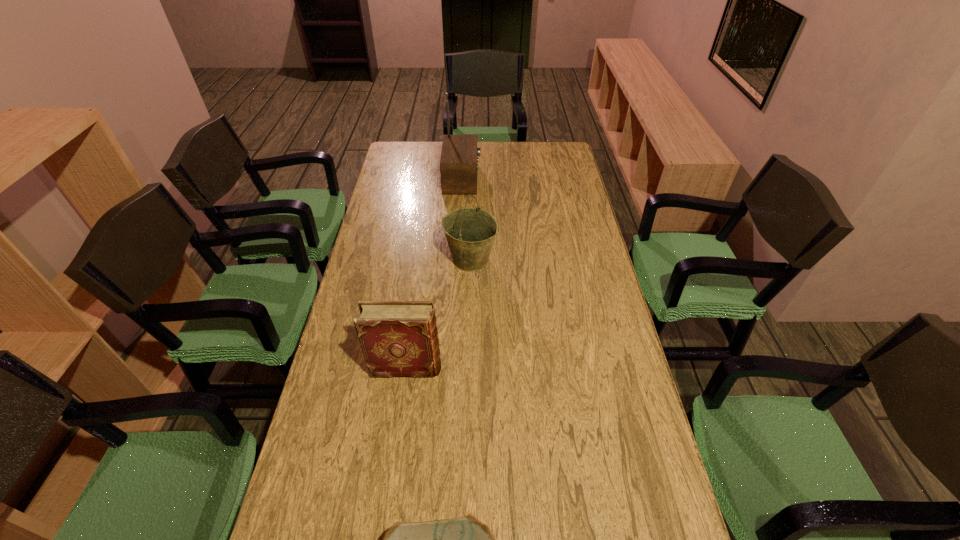
Locate an element on the screen. The width and height of the screenshot is (960, 540). free space at the right edge of the desktop is located at coordinates (560, 227).

Identify the location of vacant space at the far left corner of the desktop. Image resolution: width=960 pixels, height=540 pixels. (392, 147).

The image size is (960, 540). Find the location of `free spot between the tallest object and the hardback book`. free spot between the tallest object and the hardback book is located at coordinates (434, 273).

The width and height of the screenshot is (960, 540). I want to click on free space between the farthest object and the hardback book, so click(x=434, y=273).

Where is `free point between the hardback book and the farthest object`? The image size is (960, 540). free point between the hardback book and the farthest object is located at coordinates (434, 273).

You are a GUI agent. You are given a task and a screenshot of the screen. Output one action in this format:
    pyautogui.click(x=<x>, y=<y>)
    Task: Click on the blank region between the second nearest object and the wine bucket
    Image resolution: width=960 pixels, height=540 pixels.
    Given the screenshot: What is the action you would take?
    pyautogui.click(x=439, y=314)

Identify the location of free spot between the third nearest object and the hardback book. (439, 314).

Identify the location of object that ranks as the second closest to the third farthest object. (465, 539).

Choose which object is the second nearest neighbor to the hardback book. Please provide its 2D coordinates. Your answer should be formatted as a tuple, i.e. [(x, y)], where the tuple contains the x and y coordinates of a point satisfying the conditions above.

[(465, 539)]

I want to click on vacant space that satisfies the following two spatial constraints: 1. on the front-facing side of the third nearest object; 2. on the right side of the radio receiver, so click(x=458, y=260).